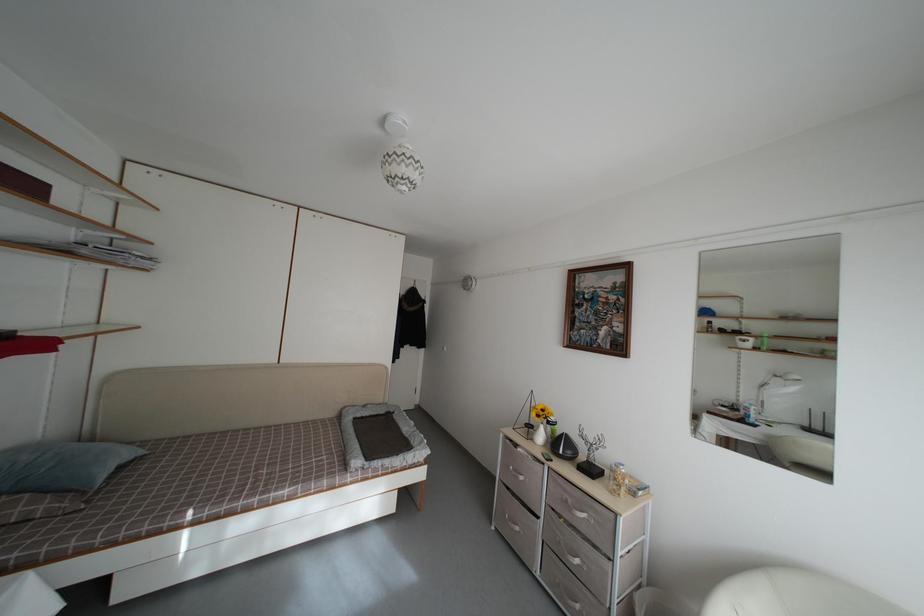
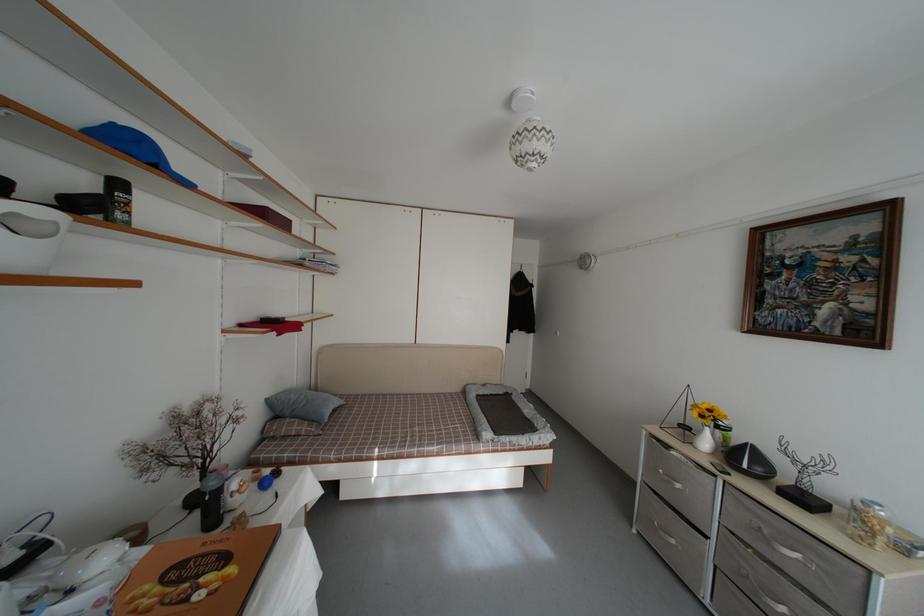
Where in the second image is the point corresponding to the point at 590,522 from the first image?

(804, 562)